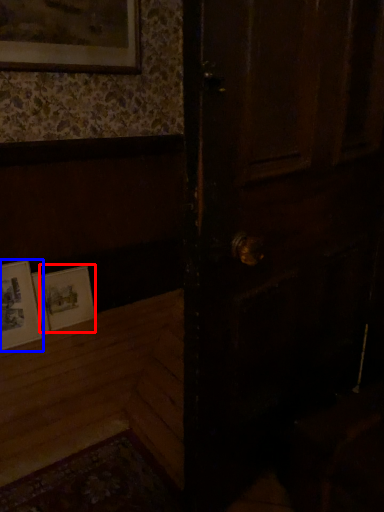
Question: Which point is closer to the camera, picture frame (highlighted by a red box) or picture frame (highlighted by a blue box)?

Choices:
 (A) picture frame
 (B) picture frame

Answer: (B)